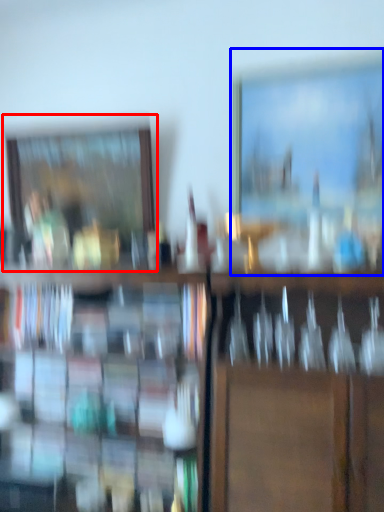
Question: Which of the following is the farthest to the observer, picture frame (highlighted by a red box) or picture frame (highlighted by a blue box)?

Choices:
 (A) picture frame
 (B) picture frame

Answer: (A)